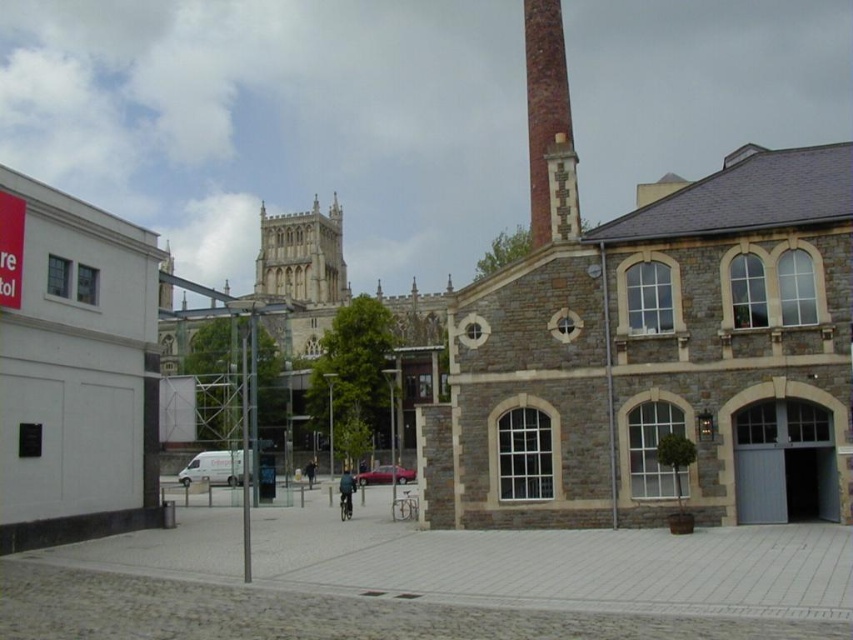
Question: Which point is farther to the camera?

Choices:
 (A) stone gothic tower at center
 (B) brick chimney at upper right

Answer: (A)

Question: Does stone gothic tower at center have a smaller size compared to brick chimney at upper right?

Choices:
 (A) yes
 (B) no

Answer: (B)

Question: Does stone gothic tower at center have a smaller size compared to brick chimney at upper right?

Choices:
 (A) no
 (B) yes

Answer: (A)

Question: Can you confirm if stone gothic tower at center is positioned to the right of brick chimney at upper right?

Choices:
 (A) no
 (B) yes

Answer: (A)